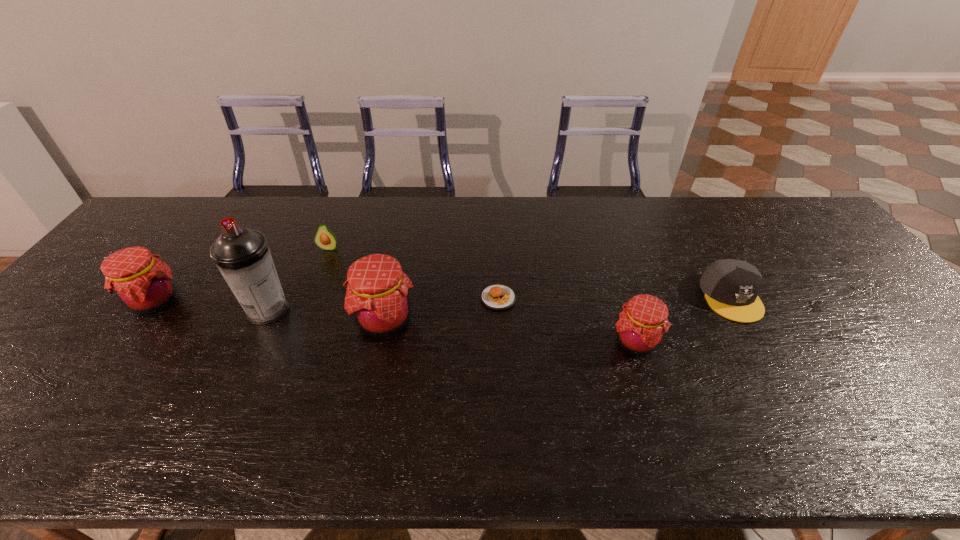
Where is `unoccupied area between the shortest jam and the fourth object from right to left`? Image resolution: width=960 pixels, height=540 pixels. unoccupied area between the shortest jam and the fourth object from right to left is located at coordinates (510, 331).

The image size is (960, 540). In order to click on vacant space that is in between the aerosol can and the third object from left to right in this screenshot , I will do `click(299, 279)`.

Image resolution: width=960 pixels, height=540 pixels. I want to click on the sixth closest object relative to the cap, so click(143, 284).

Identify the location of the fourth closest object to the fifth object from right to left. (498, 297).

Identify the location of jam that is the second closest to the farthest object. This screenshot has height=540, width=960. click(x=143, y=284).

Identify the location of jam object that ranks as the second closest to the food. (643, 321).

Where is `vacant area that satisfies the following two spatial constraints: 1. on the back side of the second jam from left to right; 2. on the left side of the shortest object`? Image resolution: width=960 pixels, height=540 pixels. vacant area that satisfies the following two spatial constraints: 1. on the back side of the second jam from left to right; 2. on the left side of the shortest object is located at coordinates (389, 298).

Image resolution: width=960 pixels, height=540 pixels. I want to click on free space that satisfies the following two spatial constraints: 1. on the front side of the second jam from right to left; 2. on the left side of the leftmost object, so click(x=139, y=321).

The height and width of the screenshot is (540, 960). I want to click on vacant point that satisfies the following two spatial constraints: 1. on the cut side of the third object from left to right; 2. on the left side of the food, so (309, 298).